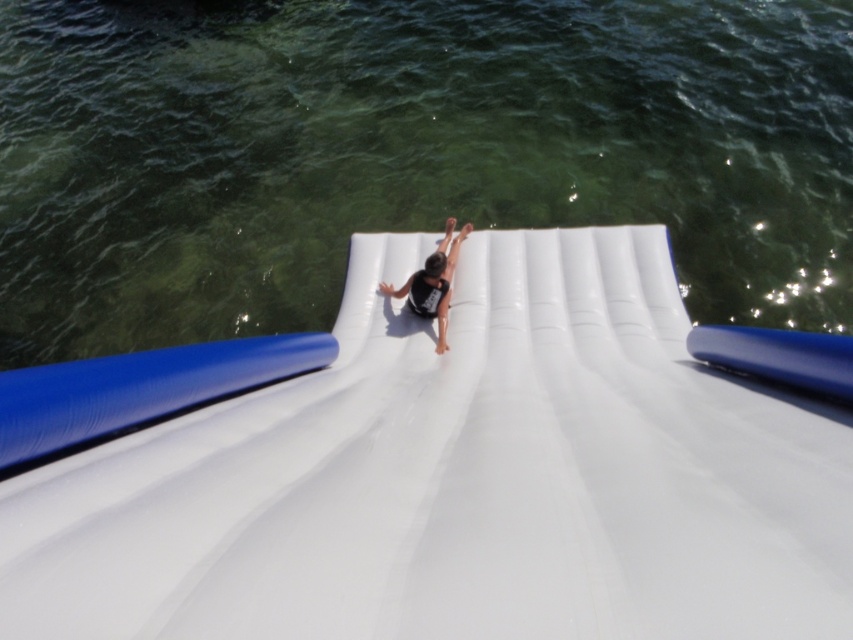
You are standing at the bottom of the white rubber slide at center and want to see the black matte person at center sliding down. From your position, will the person appear larger or smaller as they approach the end of the slide?

The white rubber slide at center is closer to the viewer than the black matte person at center, so as the person slides down towards the end, they will appear smaller to someone at the bottom because they are moving away from the viewer.

You are standing at the top of the white inflatable water slide with a blue border. You notice a point marked at coordinates [405,152]. What is the condition of the water at that specific point?

The point at coordinates [405,152] corresponds to clear water at upper center, so the water there is clear.

You are a lifeguard at a water park and you see the white rubber slide at center and the black matte person at center. Based on their positions, can you determine if the person is currently sliding down the slide?

The white rubber slide at center is below the black matte person at center, so yes, the person is sliding down the slide.